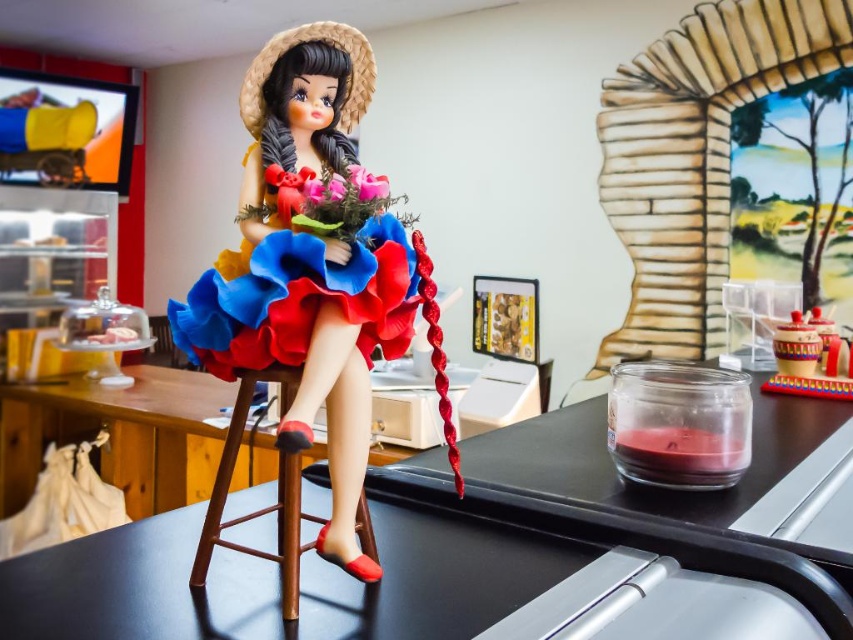
You are organizing a small event and need to place a decorative bowl on the table where the matte plastic bouquet at center is currently located. Can the matte ceramic bowl at upper right fit in the space where the bouquet is now?

The matte plastic bouquet at center has a lesser width compared to matte ceramic bowl at upper right. Therefore, the matte ceramic bowl at upper right may not fit in the current space occupied by the bouquet as it is wider.

Consider the image. You are arranging a centerpiece for a table. You have a matte ceramic bowl at upper right and a matte plastic flower at center. Where should you place the flower to avoid it blocking the bowl?

The matte plastic flower at center should be placed above the matte ceramic bowl at upper right to avoid blocking it since the bowl is currently positioned under the flower.

You are a delivery person who needs to place a small package between the matte plastic bouquet at center and the matte ceramic bowl at upper right. Which object should you move to make space?

The matte plastic bouquet at center is closer to the viewer than the matte ceramic bowl at upper right, so you should move the matte plastic bouquet at center to make space for the package.